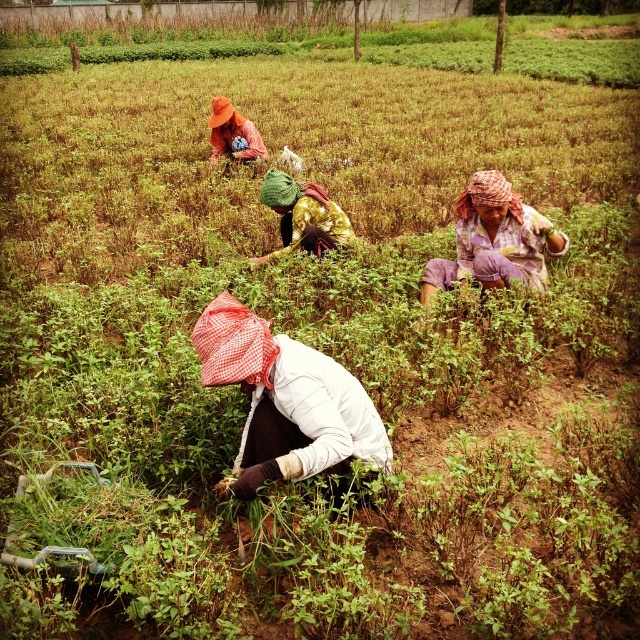
Is white cotton shirt at center to the left of plaid fabric headscarf at center from the viewer's perspective?

Indeed, white cotton shirt at center is positioned on the left side of plaid fabric headscarf at center.

Does point (257, 364) come farther from viewer compared to point (486, 232)?

No, it is not.

Does point (337, 464) come behind point (541, 282)?

That is False.

Identify the location of white cotton shirt at center. The width and height of the screenshot is (640, 640). (285, 401).

Which is in front, point (337, 225) or point (227, 140)?

Point (337, 225)

Is point (316, 188) less distant than point (234, 116)?

That is True.

Where is `green fabric headscarf at center`? green fabric headscarf at center is located at coordinates (301, 216).

Measure the distance between white cotton shirt at center and orange fabric hat at upper center.

white cotton shirt at center is 6.12 meters away from orange fabric hat at upper center.

Identify the location of white cotton shirt at center. (285, 401).

Find the location of a particular element. The width and height of the screenshot is (640, 640). white cotton shirt at center is located at coordinates (285, 401).